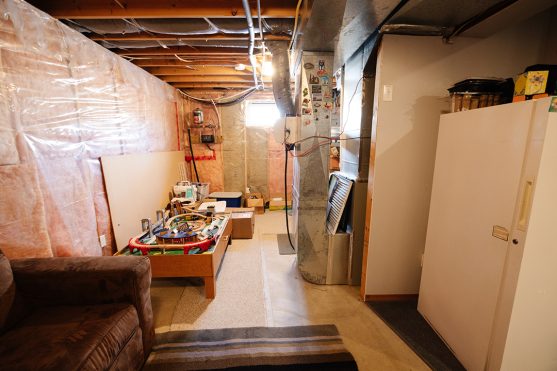
The width and height of the screenshot is (557, 371). Identify the location of plastic cover. [128, 106].